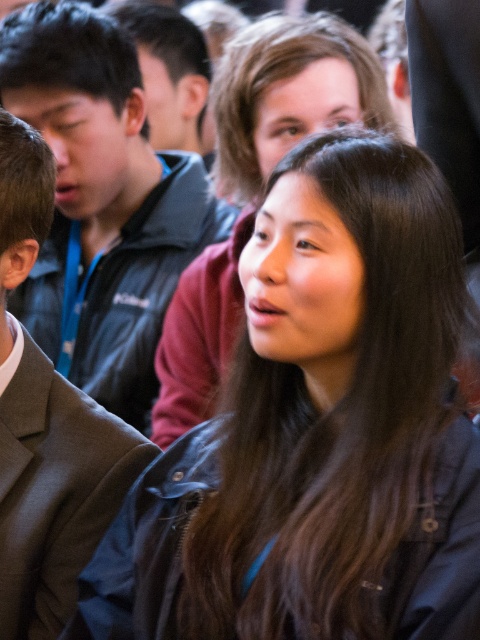
Does dark gray suit at left appear on the left side of smooth black hair at center?

Correct, you'll find dark gray suit at left to the left of smooth black hair at center.

In the scene shown: Who is shorter, dark gray suit at left or smooth black hair at center?

dark gray suit at left is shorter.

What do you see at coordinates (46, 426) in the screenshot? The width and height of the screenshot is (480, 640). I see `dark gray suit at left` at bounding box center [46, 426].

Find the location of a particular element. dark gray suit at left is located at coordinates (46, 426).

Is point (411, 547) closer to camera compared to point (57, 125)?

Yes, point (411, 547) is in front of point (57, 125).

Is point (201, 532) farther from camera compared to point (115, 369)?

No, (201, 532) is closer to viewer.

The height and width of the screenshot is (640, 480). What are the coordinates of `black leather jacket at center` in the screenshot? It's located at (317, 429).

Is dark gray suit at left to the left of matte black jacket at upper left from the viewer's perspective?

Yes, dark gray suit at left is to the left of matte black jacket at upper left.

Which of these two, dark gray suit at left or matte black jacket at upper left, stands shorter?

matte black jacket at upper left is shorter.

Between point (60, 401) and point (168, 97), which one is positioned in front?

Positioned in front is point (60, 401).

Where is `dark gray suit at left`? The width and height of the screenshot is (480, 640). dark gray suit at left is located at coordinates (46, 426).